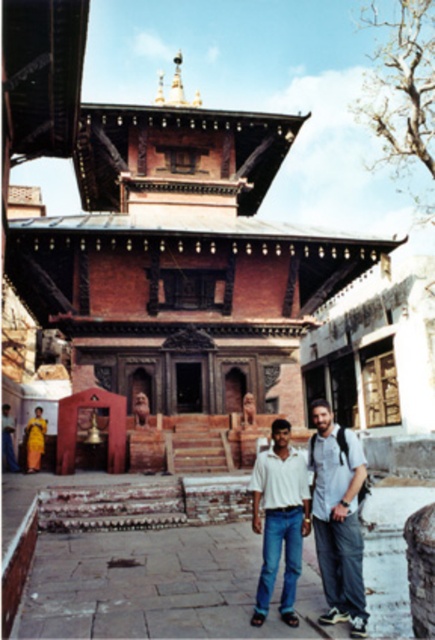
Question: Can you confirm if brown brick temple at center is wider than yellow silk sari at lower left?

Choices:
 (A) no
 (B) yes

Answer: (B)

Question: Can you confirm if brown brick temple at center is positioned below white cotton shirt at lower center?

Choices:
 (A) no
 (B) yes

Answer: (A)

Question: Which of the following is the farthest from the observer?

Choices:
 (A) brown brick temple at center
 (B) white cotton shirt at center
 (C) yellow silk sari at lower left
 (D) white cotton shirt at lower center

Answer: (C)

Question: Which object appears farthest from the camera in this image?

Choices:
 (A) white cotton shirt at lower center
 (B) yellow silk sari at lower left
 (C) white cotton shirt at center

Answer: (B)

Question: Is brown brick temple at center smaller than white cotton shirt at center?

Choices:
 (A) yes
 (B) no

Answer: (B)

Question: Among these points, which one is farthest from the camera?

Choices:
 (A) (297, 552)
 (B) (36, 436)
 (C) (116, 312)

Answer: (C)